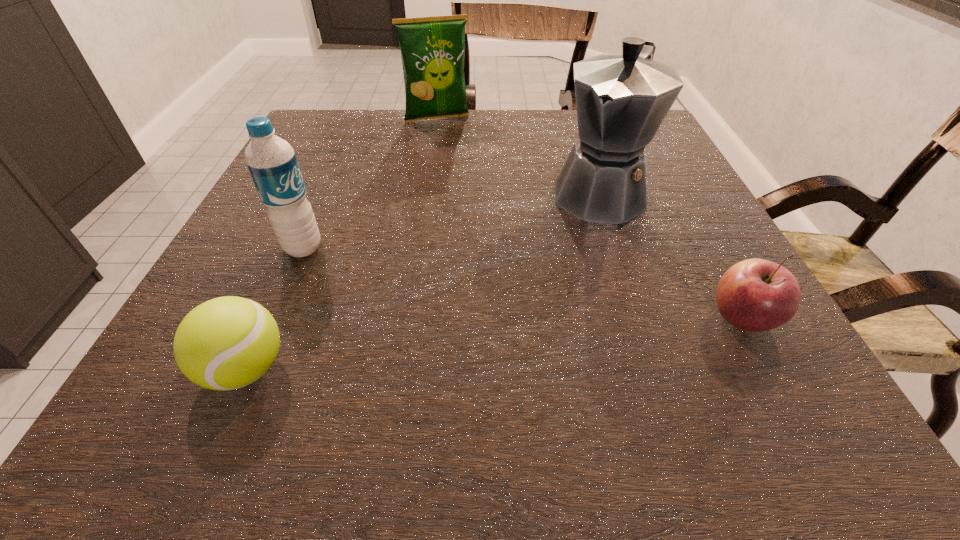
Find the location of a particular element. apple present at the near edge is located at coordinates (756, 295).

The width and height of the screenshot is (960, 540). I want to click on tennis ball at the left edge, so click(225, 343).

Locate an element on the screen. water bottle at the left edge is located at coordinates (271, 161).

You are a GUI agent. You are given a task and a screenshot of the screen. Output one action in this format:
    pyautogui.click(x=<x>, y=<y>)
    Task: Click on the apple situated at the right edge
    The image size is (960, 540).
    Given the screenshot: What is the action you would take?
    pyautogui.click(x=756, y=295)

The width and height of the screenshot is (960, 540). I want to click on coffeepot present at the right edge, so click(621, 100).

The image size is (960, 540). I want to click on object at the near left corner, so 225,343.

At what (x,y) coordinates should I click in order to perform the action: click on object at the near right corner. Please return your answer as a coordinate pair (x, y). Image resolution: width=960 pixels, height=540 pixels. Looking at the image, I should click on (756, 295).

You are a GUI agent. You are given a task and a screenshot of the screen. Output one action in this format:
    pyautogui.click(x=<x>, y=<y>)
    Task: Click on the vacant area at the far edge of the desktop
    This screenshot has width=960, height=540.
    Given the screenshot: What is the action you would take?
    pyautogui.click(x=534, y=129)

You are a GUI agent. You are given a task and a screenshot of the screen. Output one action in this format:
    pyautogui.click(x=<x>, y=<y>)
    Task: Click on the free space at the near edge of the desktop
    The image size is (960, 540).
    Given the screenshot: What is the action you would take?
    pyautogui.click(x=394, y=341)

Where is `vacant space at the left edge of the desktop`? vacant space at the left edge of the desktop is located at coordinates (268, 220).